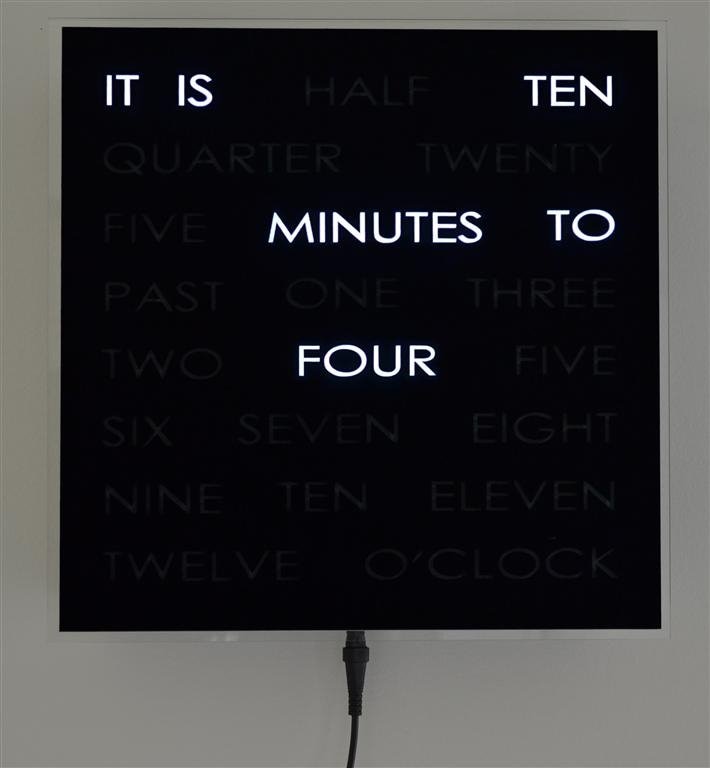
Identify the location of frame. The image size is (710, 768). click(666, 292).